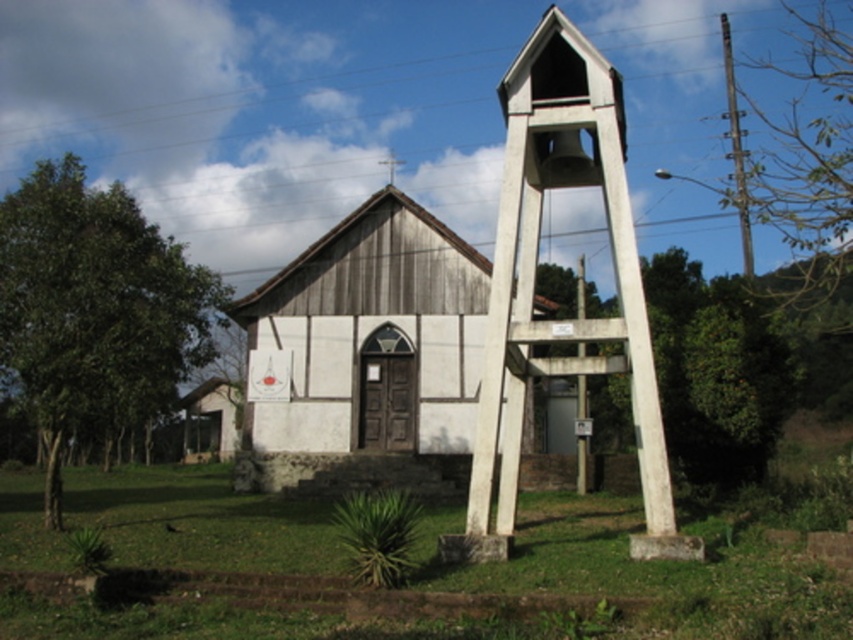
How distant is wooden church at center from white concrete bell tower at center?

6.74 meters

What do you see at coordinates (367, 355) in the screenshot? I see `wooden church at center` at bounding box center [367, 355].

Does point (430, 452) come in front of point (643, 484)?

No, it is not.

The height and width of the screenshot is (640, 853). I want to click on wooden church at center, so click(x=367, y=355).